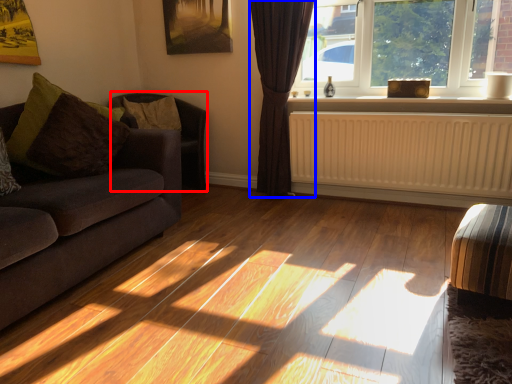
Question: Which object is closer to the camera taking this photo, armchair (highlighted by a red box) or curtain (highlighted by a blue box)?

Choices:
 (A) armchair
 (B) curtain

Answer: (B)